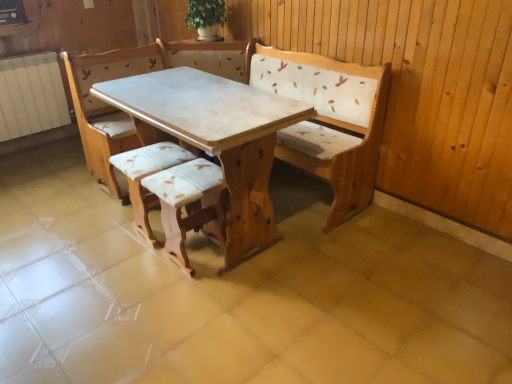
This screenshot has height=384, width=512. In order to click on white painted metal radiator at left in this screenshot , I will do `click(31, 95)`.

Identify the location of matte white cushioned stool at center, which is the second armchair in right-to-left order. (146, 176).

Image resolution: width=512 pixels, height=384 pixels. I want to click on white painted metal radiator at left, so click(31, 95).

Locate an element on the screen. Image resolution: width=512 pixels, height=384 pixels. the 1st armchair in front of the white painted metal radiator at left, counting from the anchor's position is located at coordinates (146, 176).

Would you say matte white cushioned stool at center, which is the second armchair in right-to-left order, is to the left or to the right of white painted metal radiator at left in the picture?

In the image, matte white cushioned stool at center, which is the second armchair in right-to-left order, appears on the right side of white painted metal radiator at left.

Does matte white cushioned stool at center, which is the first armchair in left-to-right order, have a lesser width compared to white painted metal radiator at left?

No, matte white cushioned stool at center, which is the first armchair in left-to-right order, is not thinner than white painted metal radiator at left.

Considering their positions, is matte white cushioned stool at center, which is the first armchair in left-to-right order, located in front of or behind white painted metal radiator at left?

matte white cushioned stool at center, which is the first armchair in left-to-right order, is in front of white painted metal radiator at left.

Can we say wooden armchair at center, the 1th armchair viewed from the right, lies outside white marble table at center?

No, wooden armchair at center, the 1th armchair viewed from the right, is not outside of white marble table at center.

From the image's perspective, who appears lower, wooden armchair at center, the 1th armchair viewed from the right, or white marble table at center?

wooden armchair at center, the 1th armchair viewed from the right.

Is wooden armchair at center, which is the 2th armchair in left-to-right order, positioned with its back to white marble table at center?

That's right, wooden armchair at center, which is the 2th armchair in left-to-right order, is facing away from white marble table at center.

How many degrees apart are the facing directions of wooden armchair at center, which is the 2th armchair in left-to-right order, and white marble table at center?

They differ by 89.1 degrees in their facing directions.

Would you say wooden armchair at center, the 1th armchair viewed from the right, contains matte white cushioned stool at center, which is the second armchair in right-to-left order?

Answer: Actually, matte white cushioned stool at center, which is the second armchair in right-to-left order, is outside wooden armchair at center, the 1th armchair viewed from the right.

Can you confirm if wooden armchair at center, the 1th armchair viewed from the right, is wider than matte white cushioned stool at center, which is the second armchair in right-to-left order?

Yes.

Is wooden armchair at center, which is the 2th armchair in left-to-right order, further to the viewer compared to matte white cushioned stool at center, which is the first armchair in left-to-right order?

That is False.

From a real-world perspective, is wooden armchair at center, the 1th armchair viewed from the right, over matte white cushioned stool at center, which is the second armchair in right-to-left order?

Yes, from a real-world perspective, wooden armchair at center, the 1th armchair viewed from the right, is over matte white cushioned stool at center, which is the second armchair in right-to-left order

Considering the sizes of white painted metal radiator at left and matte white cushioned stool at center, which is the second armchair in right-to-left order, in the image, is white painted metal radiator at left taller or shorter than matte white cushioned stool at center, which is the second armchair in right-to-left order,?

white painted metal radiator at left is taller than matte white cushioned stool at center, which is the second armchair in right-to-left order.

How many degrees apart are the facing directions of white painted metal radiator at left and matte white cushioned stool at center, which is the second armchair in right-to-left order?

They differ by 85.6 degrees in their facing directions.

From a real-world perspective, is white painted metal radiator at left positioned above or below matte white cushioned stool at center, which is the first armchair in left-to-right order?

white painted metal radiator at left is above matte white cushioned stool at center, which is the first armchair in left-to-right order.

Is the position of white painted metal radiator at left less distant than that of matte white cushioned stool at center, which is the first armchair in left-to-right order?

No, it is not.

Consider the image. From a real-world perspective, is white marble table at center beneath white painted metal radiator at left?

Yes, from a real-world perspective, white marble table at center is below white painted metal radiator at left.

In terms of height, does white marble table at center look taller or shorter compared to white painted metal radiator at left?

Considering their sizes, white marble table at center has more height than white painted metal radiator at left.

From the image's perspective, which object appears higher, white marble table at center or white painted metal radiator at left?

white painted metal radiator at left is shown above in the image.

Is white marble table at center inside the boundaries of white painted metal radiator at left, or outside?

white marble table at center lies outside white painted metal radiator at left.

Which is correct: white marble table at center is inside matte white cushioned stool at center, which is the first armchair in left-to-right order, or outside of it?

white marble table at center cannot be found inside matte white cushioned stool at center, which is the first armchair in left-to-right order.

Is white marble table at center thinner than matte white cushioned stool at center, which is the first armchair in left-to-right order?

→ Incorrect, the width of white marble table at center is not less than that of matte white cushioned stool at center, which is the first armchair in left-to-right order.

From the image's perspective, is white marble table at center located above or below matte white cushioned stool at center, which is the first armchair in left-to-right order?

Based on their image positions, white marble table at center is located above matte white cushioned stool at center, which is the first armchair in left-to-right order.

In the image, is white marble table at center positioned in front of or behind matte white cushioned stool at center, which is the first armchair in left-to-right order?

Visually, white marble table at center is located in front of matte white cushioned stool at center, which is the first armchair in left-to-right order.

Considering their positions, is white marble table at center located in front of or behind wooden armchair at center, the 1th armchair viewed from the right?

In the image, white marble table at center appears in front of wooden armchair at center, the 1th armchair viewed from the right.

From the image's perspective, between white marble table at center and wooden armchair at center, which is the 2th armchair in left-to-right order, who is located below?

wooden armchair at center, which is the 2th armchair in left-to-right order, is shown below in the image.

Which point is more forward, (231, 108) or (200, 205)?

Positioned in front is point (231, 108).

Where is `the 1st armchair counting from the right of the white painted metal radiator at left`? This screenshot has width=512, height=384. the 1st armchair counting from the right of the white painted metal radiator at left is located at coordinates (146, 176).

Where is `table that appears in front of the wooden armchair at center, the 1th armchair viewed from the right`? table that appears in front of the wooden armchair at center, the 1th armchair viewed from the right is located at coordinates (215, 136).

When comparing their distances from white marble table at center, does matte white cushioned stool at center, which is the second armchair in right-to-left order, or white painted metal radiator at left seem further?

white painted metal radiator at left is positioned further to the anchor white marble table at center.

From the picture: Estimate the real-world distances between objects in this image. Which object is closer to white painted metal radiator at left, white marble table at center or matte white cushioned stool at center, which is the first armchair in left-to-right order?

matte white cushioned stool at center, which is the first armchair in left-to-right order, lies closer to white painted metal radiator at left than the other object.

In the scene shown: Looking at the image, which one is located closer to matte white cushioned stool at center, which is the second armchair in right-to-left order, white marble table at center or wooden armchair at center, the 1th armchair viewed from the right?

wooden armchair at center, the 1th armchair viewed from the right, is closer to matte white cushioned stool at center, which is the second armchair in right-to-left order.

From the image, which object appears to be farther from matte white cushioned stool at center, which is the second armchair in right-to-left order, white painted metal radiator at left or white marble table at center?

Among the two, white painted metal radiator at left is located further to matte white cushioned stool at center, which is the second armchair in right-to-left order.

Estimate the real-world distances between objects in this image. Which object is closer to matte white cushioned stool at center, which is the first armchair in left-to-right order, wooden armchair at center, which is the 2th armchair in left-to-right order, or white marble table at center?

wooden armchair at center, which is the 2th armchair in left-to-right order.

Based on their spatial positions, is matte white cushioned stool at center, which is the second armchair in right-to-left order, or white marble table at center further from wooden armchair at center, the 1th armchair viewed from the right?

white marble table at center.

Based on their spatial positions, is matte white cushioned stool at center, which is the first armchair in left-to-right order, or white marble table at center closer to white painted metal radiator at left?

matte white cushioned stool at center, which is the first armchair in left-to-right order, is closer to white painted metal radiator at left.

When comparing their distances from white marble table at center, does wooden armchair at center, which is the 2th armchair in left-to-right order, or matte white cushioned stool at center, which is the second armchair in right-to-left order, seem further?

matte white cushioned stool at center, which is the second armchair in right-to-left order.

At what (x,y) coordinates should I click in order to perform the action: click on armchair located between white painted metal radiator at left and wooden armchair at center, the 1th armchair viewed from the right, in the left-right direction. Please return your answer as a coordinate pair (x, y). The width and height of the screenshot is (512, 384). Looking at the image, I should click on (146, 176).

Where is `armchair located between white marble table at center and matte white cushioned stool at center, which is the second armchair in right-to-left order, in the depth direction`? The image size is (512, 384). armchair located between white marble table at center and matte white cushioned stool at center, which is the second armchair in right-to-left order, in the depth direction is located at coordinates (188, 203).